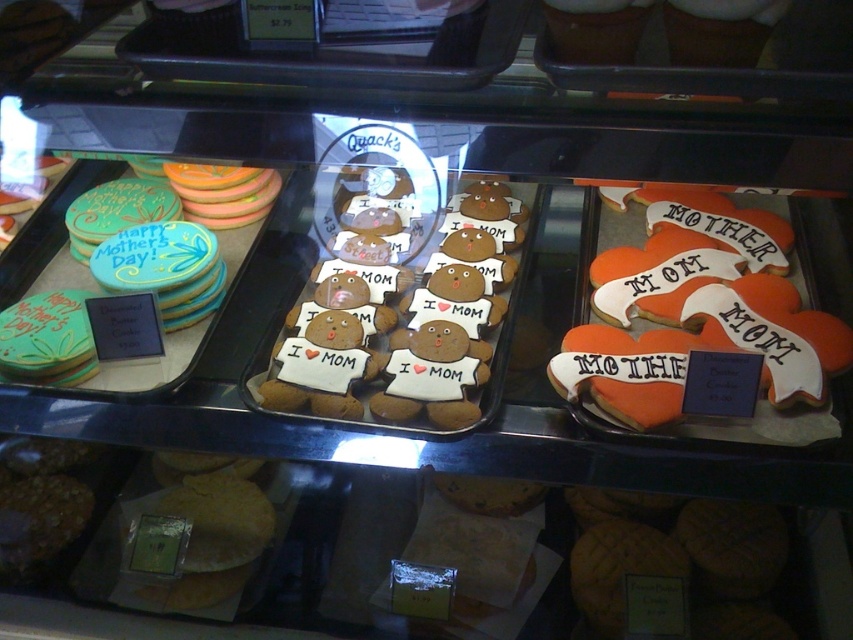
Does point (341, 204) lie behind point (614, 252)?

Yes, point (341, 204) is farther from viewer.

Which is in front, point (502, 280) or point (621, 307)?

Point (621, 307) is in front.

The width and height of the screenshot is (853, 640). I want to click on brown sugar cookies at center, so click(399, 307).

Does orange frosted heart-shaped cookies at center-right have a greater width compared to matte green cookie at left?

Yes, orange frosted heart-shaped cookies at center-right is wider than matte green cookie at left.

Between point (764, 387) and point (54, 268), which one is positioned behind?

The point (54, 268) is behind.

Identify the location of orange frosted heart-shaped cookies at center-right. The width and height of the screenshot is (853, 640). (698, 317).

What do you see at coordinates (399, 307) in the screenshot?
I see `brown sugar cookies at center` at bounding box center [399, 307].

Identify the location of brown sugar cookies at center. This screenshot has width=853, height=640. (399, 307).